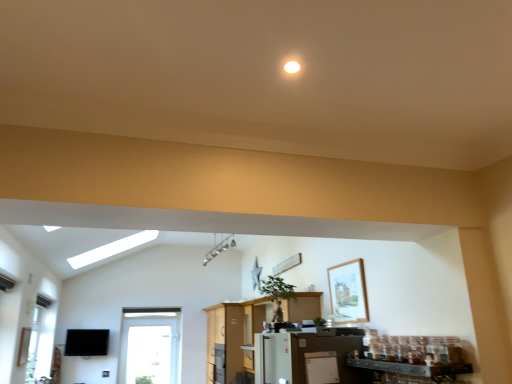
Question: Is white matte refrigerator at lower center taller or shorter than white glossy refrigerator at center?

Choices:
 (A) short
 (B) tall

Answer: (A)

Question: Relative to white glossy refrigerator at center, is white matte refrigerator at lower center in front or behind?

Choices:
 (A) front
 (B) behind

Answer: (A)

Question: Estimate the real-world distances between objects in this image. Which object is closer to the wooden framed picture at upper right?

Choices:
 (A) transparent glass window at lower left
 (B) white matte refrigerator at lower center
 (C) white glossy refrigerator at center

Answer: (B)

Question: Estimate the real-world distances between objects in this image. Which object is closer to the white matte refrigerator at lower center?

Choices:
 (A) white glossy refrigerator at center
 (B) transparent glass window at lower left
 (C) wooden framed picture at upper right

Answer: (C)